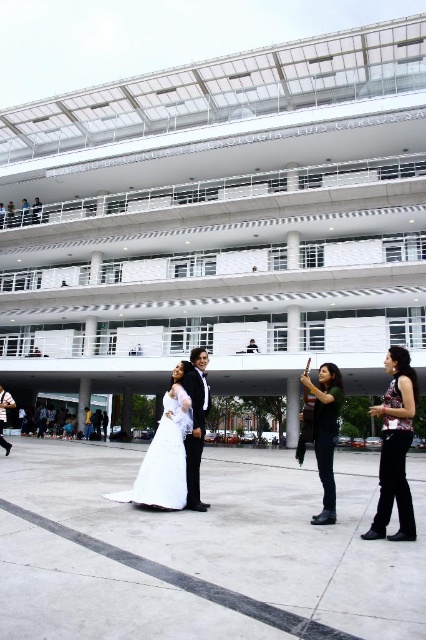
Question: Does white satin dress at lower center have a greater width compared to denim jacket at lower right?

Choices:
 (A) yes
 (B) no

Answer: (B)

Question: Is white satin dress at center below denim jacket at lower right?

Choices:
 (A) yes
 (B) no

Answer: (A)

Question: Which of the following is the farthest from the observer?

Choices:
 (A) (400, 460)
 (B) (169, 470)

Answer: (B)

Question: Is printed fabric blouse at lower right bigger than shiny black suit at center?

Choices:
 (A) yes
 (B) no

Answer: (A)

Question: Estimate the real-world distances between objects in this image. Which object is closer to the white satin dress at lower center?

Choices:
 (A) white satin dress at center
 (B) shiny black suit at center
 (C) printed fabric blouse at lower right
 (D) denim jacket at lower right

Answer: (C)

Question: Which object is positioned closest to the white satin dress at lower center?

Choices:
 (A) denim jacket at lower right
 (B) shiny black suit at center

Answer: (A)